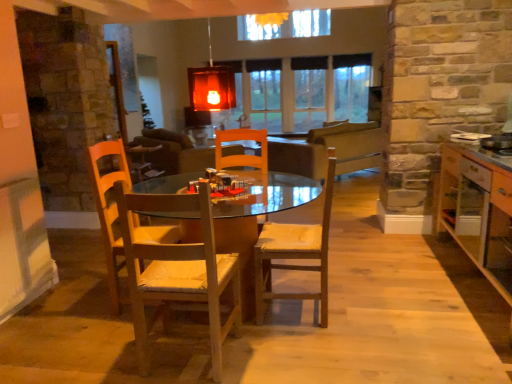
Where is `vacant area that lies between wooden chair at center, marked as the second chair in a right-to-left arrangement, and wooden table at center`? The height and width of the screenshot is (384, 512). vacant area that lies between wooden chair at center, marked as the second chair in a right-to-left arrangement, and wooden table at center is located at coordinates tap(227, 375).